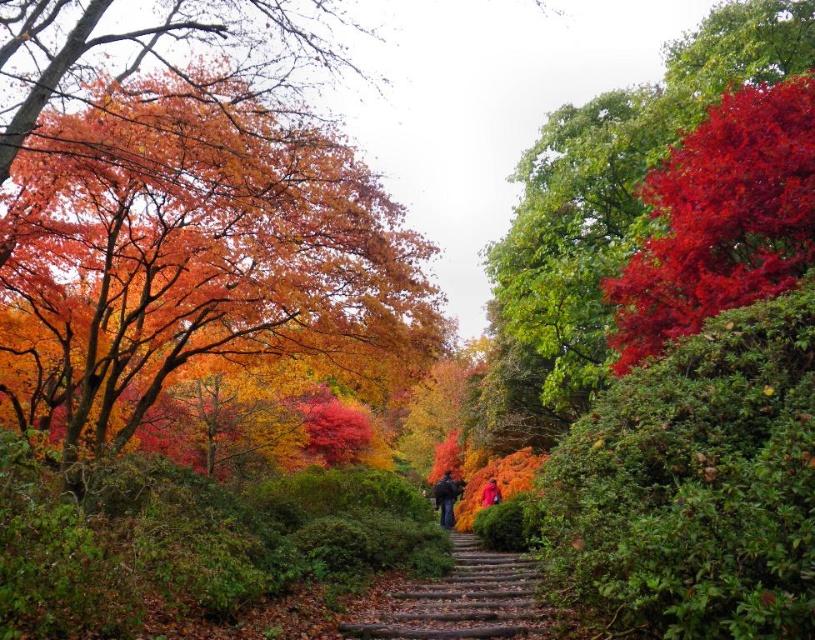
Question: Which point is farther to the camera?

Choices:
 (A) (135, 412)
 (B) (485, 492)
 (C) (778, 108)

Answer: (B)

Question: Is vivid orange leaves at left further to camera compared to vivid red leaves at upper right?

Choices:
 (A) yes
 (B) no

Answer: (B)

Question: Is bright red leaves at upper right closer to the viewer compared to matte red coat at center?

Choices:
 (A) no
 (B) yes

Answer: (B)

Question: Which object is the closest to the brown wooden stairs at center?

Choices:
 (A) vivid orange leaves at left
 (B) vivid red leaves at upper right
 (C) dark blue jacket at center

Answer: (A)

Question: Can you confirm if vivid red leaves at upper right is positioned below dark blue jacket at center?

Choices:
 (A) yes
 (B) no

Answer: (B)

Question: Which of these objects is positioned farthest from the bright red leaves at upper right?

Choices:
 (A) brown wooden stairs at center
 (B) matte red coat at center
 (C) dark blue jacket at center
 (D) vivid orange leaves at left

Answer: (C)